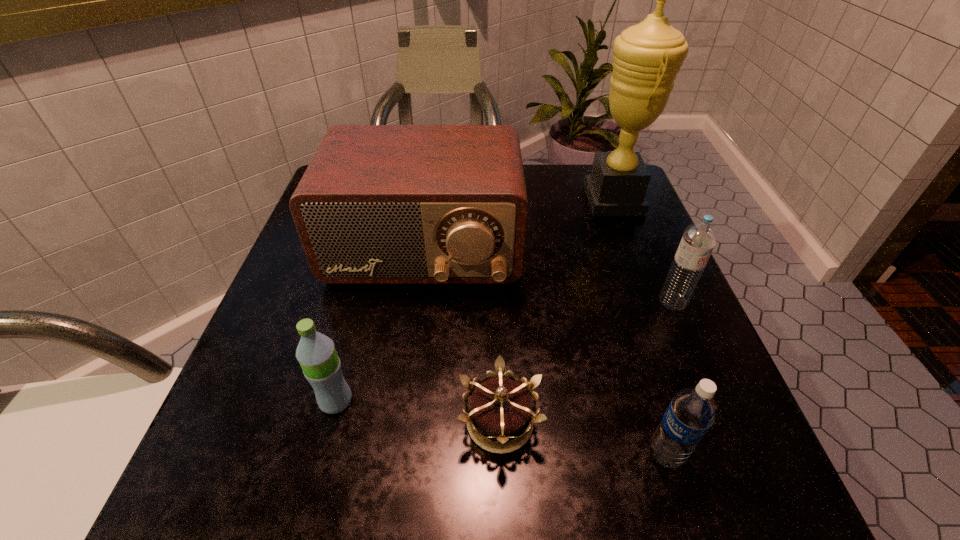
At what (x,y) coordinates should I click in order to perform the action: click on free region located on the left of the farthest water bottle. Please return your answer as a coordinate pair (x, y). This screenshot has height=540, width=960. Looking at the image, I should click on (561, 301).

Locate an element on the screen. This screenshot has width=960, height=540. vacant space located 0.180m on the right of the leftmost water bottle is located at coordinates (466, 401).

Find the location of a particular element. The image size is (960, 540). vacant region located on the back of the nearest water bottle is located at coordinates (606, 259).

Where is `vacant space positioned 0.280m on the right of the crown`? This screenshot has height=540, width=960. vacant space positioned 0.280m on the right of the crown is located at coordinates (723, 422).

Identify the location of trophy cup located at the far edge. The width and height of the screenshot is (960, 540). (647, 57).

The width and height of the screenshot is (960, 540). Find the location of `radio receiver located at the far edge`. radio receiver located at the far edge is located at coordinates (378, 204).

Identify the location of water bottle located in the near edge section of the desktop. (693, 410).

At what (x,y) coordinates should I click in order to perform the action: click on crown that is positioned at the near edge. Please return your answer as a coordinate pair (x, y). The image size is (960, 540). Looking at the image, I should click on (500, 408).

The width and height of the screenshot is (960, 540). Find the location of `radio receiver that is at the left edge`. radio receiver that is at the left edge is located at coordinates (378, 204).

Find the location of a particular element. This screenshot has height=540, width=960. water bottle that is at the left edge is located at coordinates (321, 366).